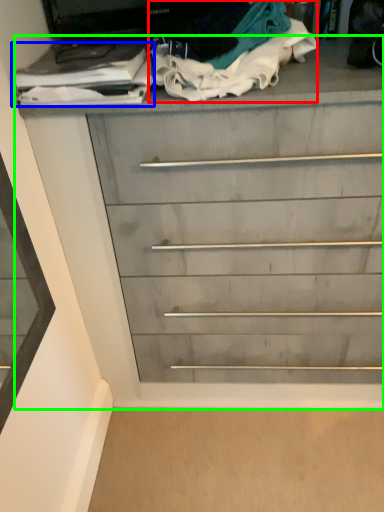
Question: Based on their relative distances, which object is nearer to clothing (highlighted by a red box)? Choose from clothing (highlighted by a blue box) and chest of drawers (highlighted by a green box).

Choices:
 (A) clothing
 (B) chest of drawers

Answer: (A)